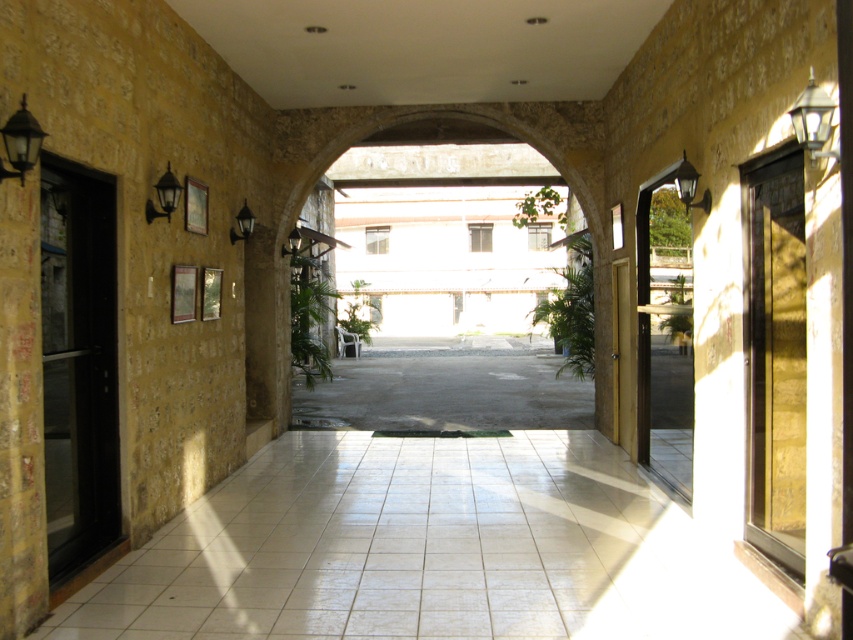
Question: Does white glossy streetlamp at upper right lie in front of matte black lamp at upper left?

Choices:
 (A) no
 (B) yes

Answer: (B)

Question: Is the position of matte black lamp at upper left more distant than that of matte black lamp at center?

Choices:
 (A) no
 (B) yes

Answer: (A)

Question: Is stone archway at center positioned in front of matte black wall lamp at upper left?

Choices:
 (A) yes
 (B) no

Answer: (B)

Question: Which point appears farthest from the camera in this image?

Choices:
 (A) (288, 250)
 (B) (35, 131)

Answer: (A)

Question: Which point is farther to the camera?

Choices:
 (A) (158, 200)
 (B) (595, 193)
 (C) (813, 150)

Answer: (B)

Question: Among these points, which one is farthest from the camera?

Choices:
 (A) [x=288, y=241]
 (B) [x=393, y=125]

Answer: (B)